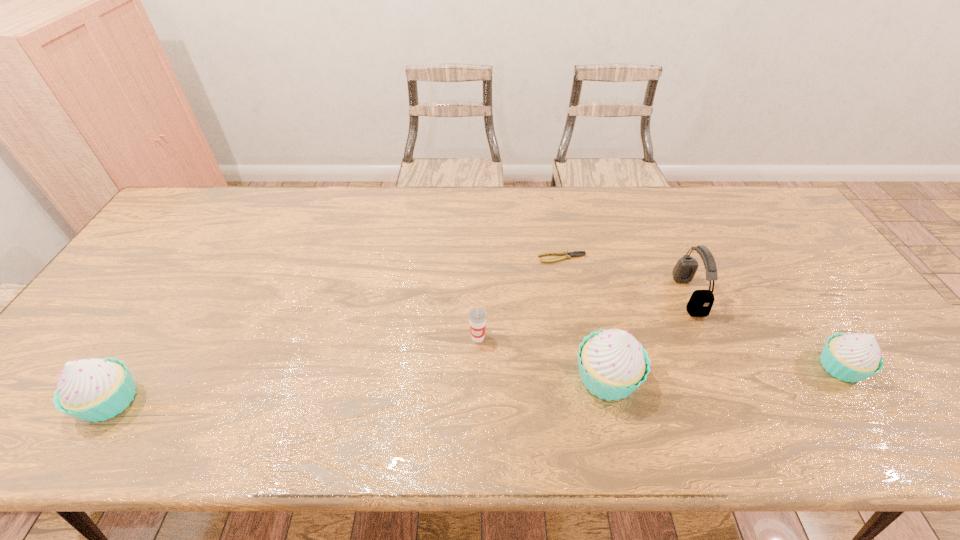
What are the coordinates of `vacant space that satisfies the following two spatial constraints: 1. on the back side of the second cupcake from right to left; 2. on the left side of the rightmost cupcake` in the screenshot? It's located at (604, 367).